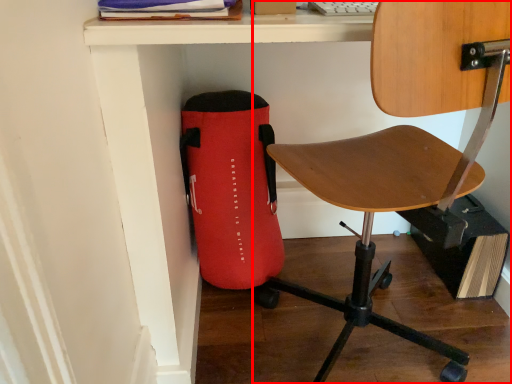
Question: From the image's perspective, where is chair (annotated by the red box) located in relation to bag in the image?

Choices:
 (A) above
 (B) below

Answer: (A)